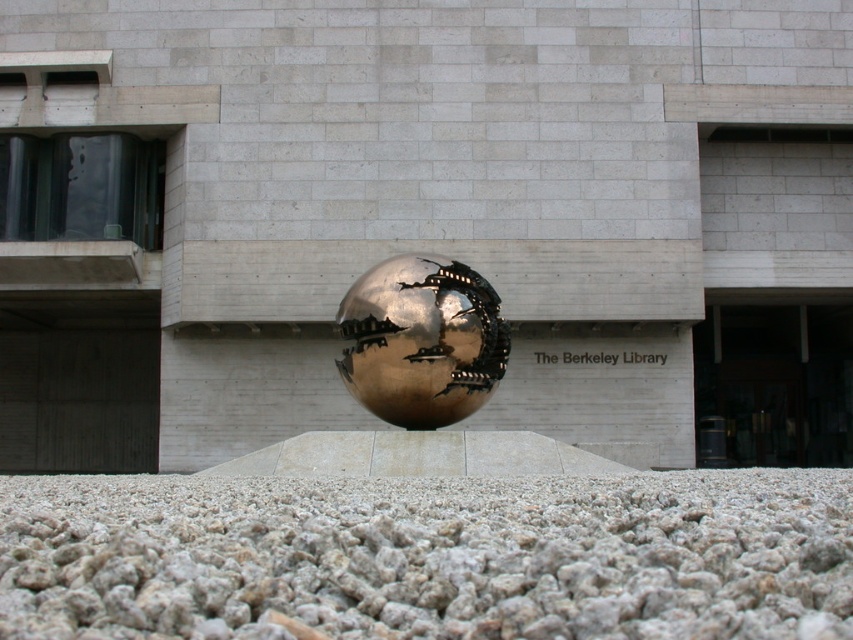
Which is below, gray gravel at lower center or gold metallic sphere at center?

Positioned lower is gray gravel at lower center.

Can you confirm if gray gravel at lower center is shorter than gold metallic sphere at center?

Correct, gray gravel at lower center is not as tall as gold metallic sphere at center.

In order to click on gray gravel at lower center in this screenshot , I will do `click(428, 556)`.

At what (x,y) coordinates should I click in order to perform the action: click on gray gravel at lower center. Please return your answer as a coordinate pair (x, y). The image size is (853, 640). Looking at the image, I should click on (428, 556).